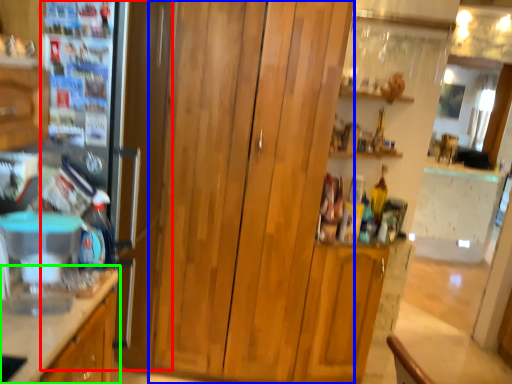
Question: Estimate the real-world distances between objects in this image. Which object is closer to fridge (highlighted by a red box), dresser (highlighted by a blue box) or cabinetry (highlighted by a green box)?

Choices:
 (A) dresser
 (B) cabinetry

Answer: (A)